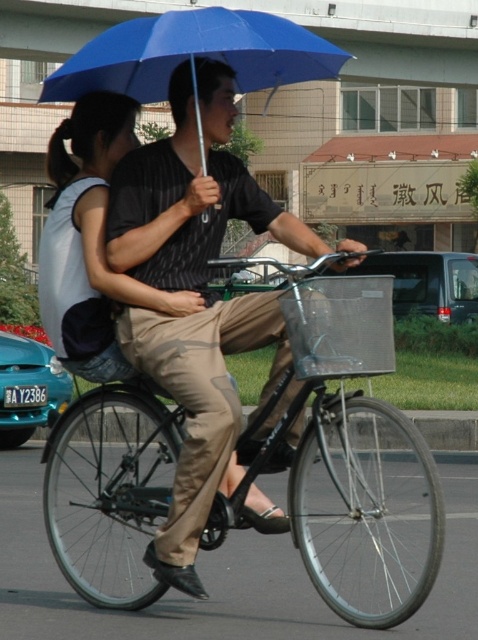
Question: Observing the image, what is the correct spatial positioning of metallic silver bicycle at center in reference to matte black shirt at center?

Choices:
 (A) right
 (B) left

Answer: (A)

Question: In this image, where is metallic silver bicycle at center located relative to matte black shirt at center?

Choices:
 (A) left
 (B) right

Answer: (B)

Question: Which of these objects is positioned closest to the metallic silver bicycle at center?

Choices:
 (A) blue matte umbrella at upper center
 (B) matte black shirt at center

Answer: (B)

Question: Can you confirm if metallic silver bicycle at center is positioned below matte black shirt at center?

Choices:
 (A) no
 (B) yes

Answer: (B)

Question: Which of the following is the farthest from the observer?

Choices:
 (A) blue matte umbrella at upper center
 (B) metallic silver bicycle at center
 (C) matte black shirt at center

Answer: (B)

Question: Estimate the real-world distances between objects in this image. Which object is closer to the blue matte umbrella at upper center?

Choices:
 (A) metallic silver bicycle at center
 (B) matte black shirt at center

Answer: (B)